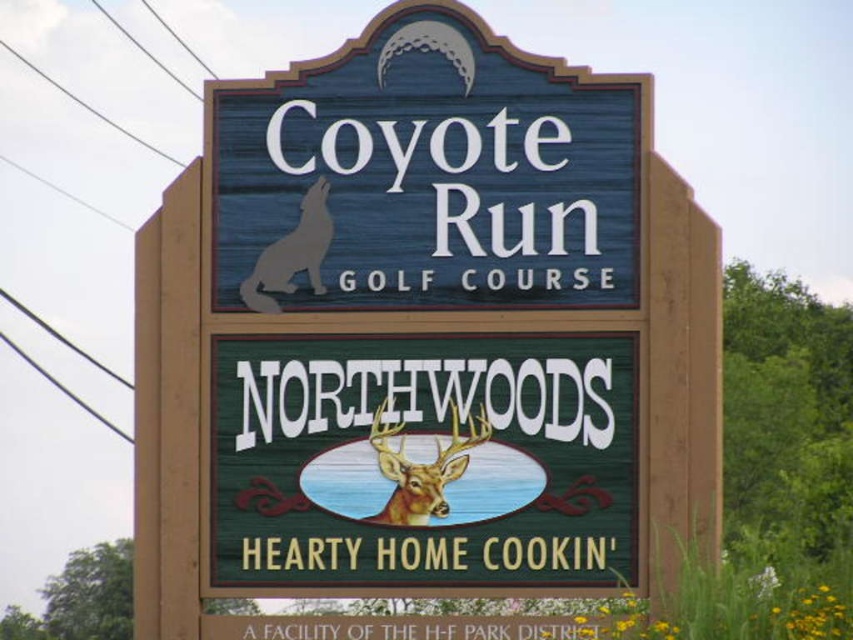
Question: Among these points, which one is farthest from the camera?

Choices:
 (A) (270, 259)
 (B) (444, 508)
 (C) (312, 106)

Answer: (C)

Question: Can you confirm if wooden sign at center is positioned to the left of gray matte wolf at upper left?

Choices:
 (A) no
 (B) yes

Answer: (A)

Question: Which object is positioned farthest from the wooden sign at center?

Choices:
 (A) gray matte wolf at upper left
 (B) shiny brown deer at center

Answer: (B)

Question: Can you confirm if wooden sign at center is positioned above shiny brown deer at center?

Choices:
 (A) no
 (B) yes

Answer: (B)

Question: From the image, what is the correct spatial relationship of wooden sign at center in relation to shiny brown deer at center?

Choices:
 (A) below
 (B) above

Answer: (B)

Question: Which object is the closest to the shiny brown deer at center?

Choices:
 (A) gray matte wolf at upper left
 (B) wooden sign at center

Answer: (B)